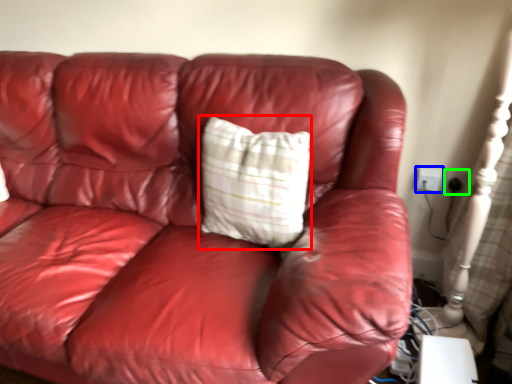
Question: Based on their relative distances, which object is farther from pillow (highlighted by a red box)? Choose from electric outlet (highlighted by a blue box) and electric outlet (highlighted by a green box).

Choices:
 (A) electric outlet
 (B) electric outlet

Answer: (B)